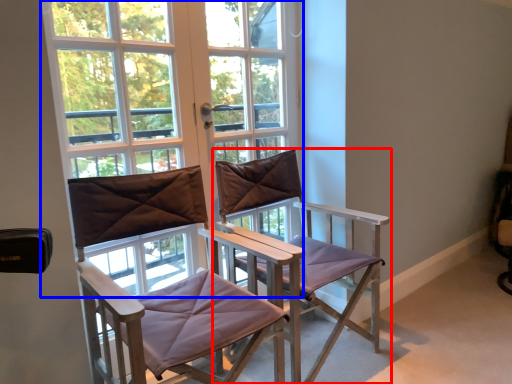
Question: Which of the following is the farthest to the observer, chair (highlighted by a red box) or window (highlighted by a blue box)?

Choices:
 (A) chair
 (B) window

Answer: (B)